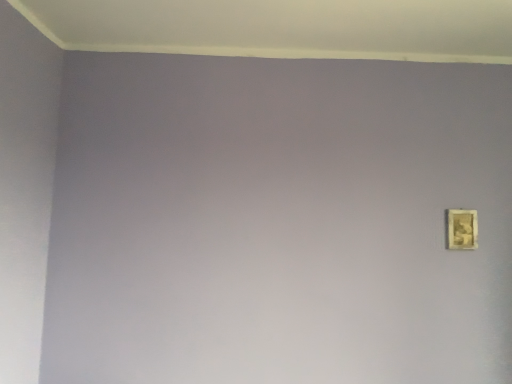
At what (x,y) coordinates should I click in order to perform the action: click on gold textured picture frame at right. Please return your answer as a coordinate pair (x, y). Looking at the image, I should click on (462, 229).

Measure the distance between point (454, 226) and camera.

A distance of 6.33 feet exists between point (454, 226) and camera.

Describe the element at coordinates (462, 229) in the screenshot. The image size is (512, 384). I see `gold textured picture frame at right` at that location.

I want to click on gold textured picture frame at right, so click(462, 229).